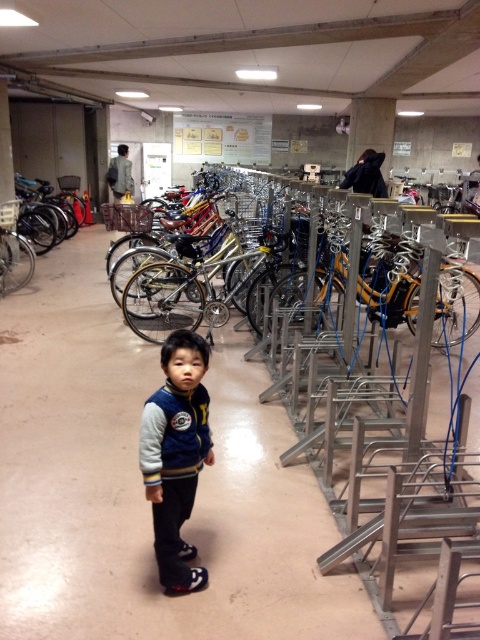
Is point (373, 280) closer to camera compared to point (184, 483)?

No, (373, 280) is further to viewer.

Between point (286, 291) and point (188, 484), which one is positioned in front?

Point (188, 484)

The height and width of the screenshot is (640, 480). Identify the location of shiny metallic bicycle at center. (206, 275).